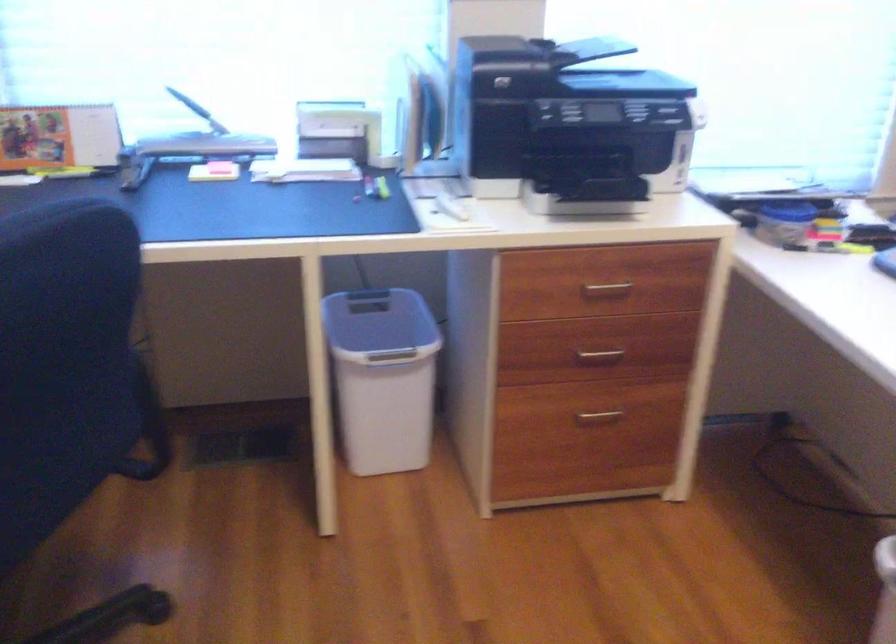
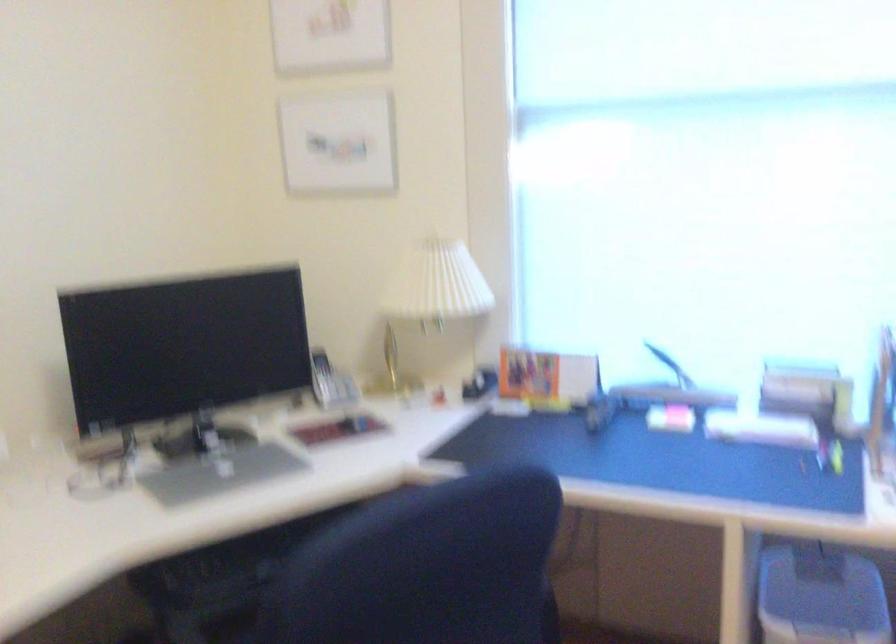
Question: Based on the continuous images, in which direction is the camera rotating? Reply with the corresponding letter.

Choices:
 (A) Left
 (B) Right
 (C) Up
 (D) Down

Answer: (A)